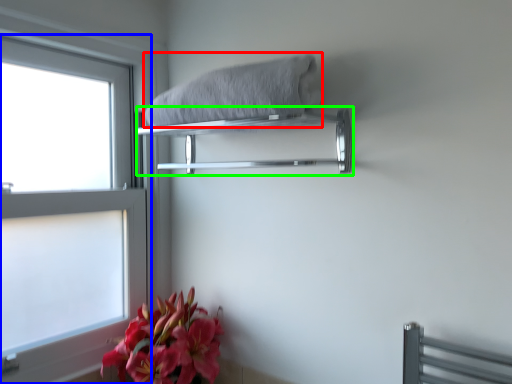
Question: Which object is positioned farthest from bath towel (highlighted by a red box)? Select from window (highlighted by a blue box) and balustrade (highlighted by a green box).

Choices:
 (A) window
 (B) balustrade

Answer: (A)